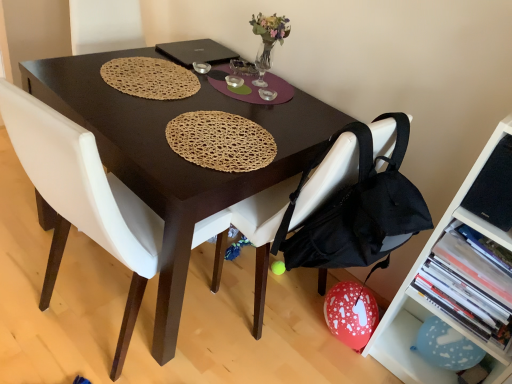
Question: Is white leather chair at center, the first chair viewed from the left, inside or outside of black matte laptop at center?

Choices:
 (A) outside
 (B) inside

Answer: (A)

Question: Is point (24, 102) positioned closer to the camera than point (188, 43)?

Choices:
 (A) closer
 (B) farther

Answer: (A)

Question: Which of these objects is positioned farthest from the black matte laptop at center?

Choices:
 (A) blue paper balloon at lower right, which is the first shelf from bottom to top
 (B) translucent glass vase at upper center
 (C) black fabric chair at lower right, the 2th chair in the left-to-right sequence
 (D) metallic silver bowl at center
 (E) woven brown placemat at upper center

Answer: (A)

Question: Based on their relative distances, which object is nearer to the blue paper balloon at lower right, marked as the second shelf in a top-to-bottom arrangement?

Choices:
 (A) white leather chair at center, which is the 2th chair in right-to-left order
 (B) black fabric chair at lower right, the 2th chair in the left-to-right sequence
 (C) metallic silver bowl at center
 (D) white plastic shelf at lower right, the second shelf when ordered from bottom to top
 (E) black matte laptop at center

Answer: (D)